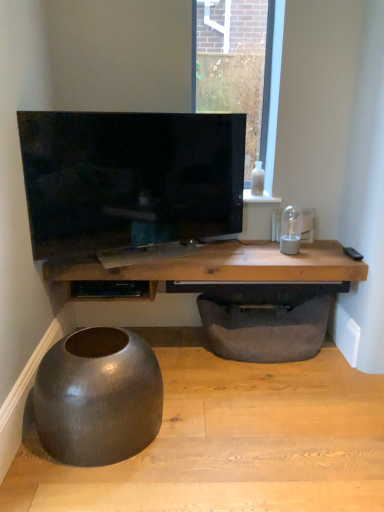
Where is `vacant space that is in between matte black bowl at lower left and dark gray fabric footrest at lower center`? This screenshot has height=512, width=384. vacant space that is in between matte black bowl at lower left and dark gray fabric footrest at lower center is located at coordinates tap(214, 388).